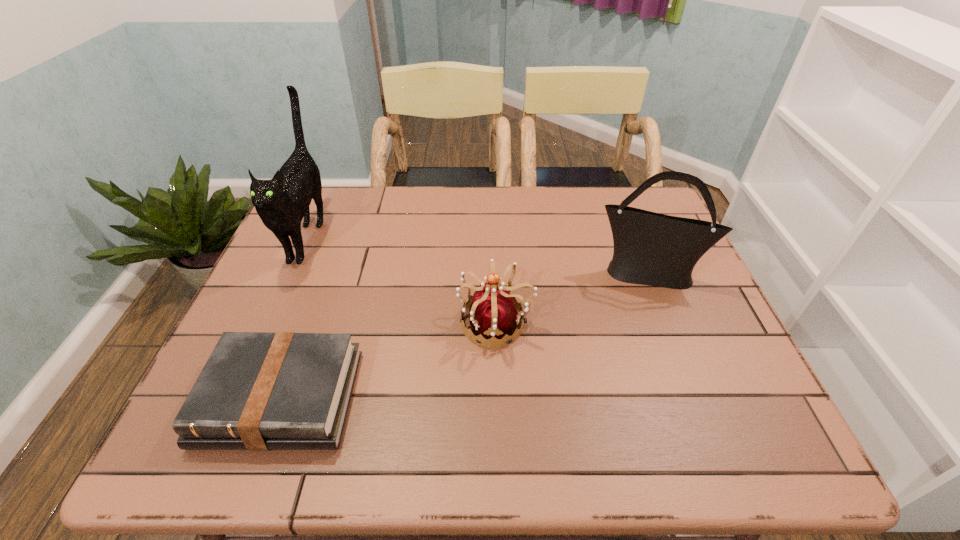
This screenshot has height=540, width=960. Identify the location of vacant area at the left edge. (293, 315).

The image size is (960, 540). In the image, there is a desktop. Find the location of `free space at the right edge`. free space at the right edge is located at coordinates (722, 336).

Find the location of a particular element. free spot at the far left corner of the desktop is located at coordinates (333, 204).

You are a GUI agent. You are given a task and a screenshot of the screen. Output one action in this format:
    pyautogui.click(x=<x>, y=<y>)
    Task: Click on the free space at the far right corner of the desktop
    This screenshot has width=960, height=540.
    Given the screenshot: What is the action you would take?
    pyautogui.click(x=658, y=200)

The image size is (960, 540). I want to click on vacant point located between the tallest object and the shortest object, so pyautogui.click(x=295, y=317).

I want to click on vacant area that lies between the cat and the second shortest object, so click(x=402, y=279).

Identify the location of free space that is in between the cat and the rightmost object. Image resolution: width=960 pixels, height=540 pixels. (477, 255).

I want to click on empty space between the cat and the hardback book, so click(x=295, y=317).

Where is `vacant area between the tallest object and the tiara`? vacant area between the tallest object and the tiara is located at coordinates (402, 279).

Locate an element on the screen. The image size is (960, 540). free area in between the shortest object and the third object from left to right is located at coordinates (389, 360).